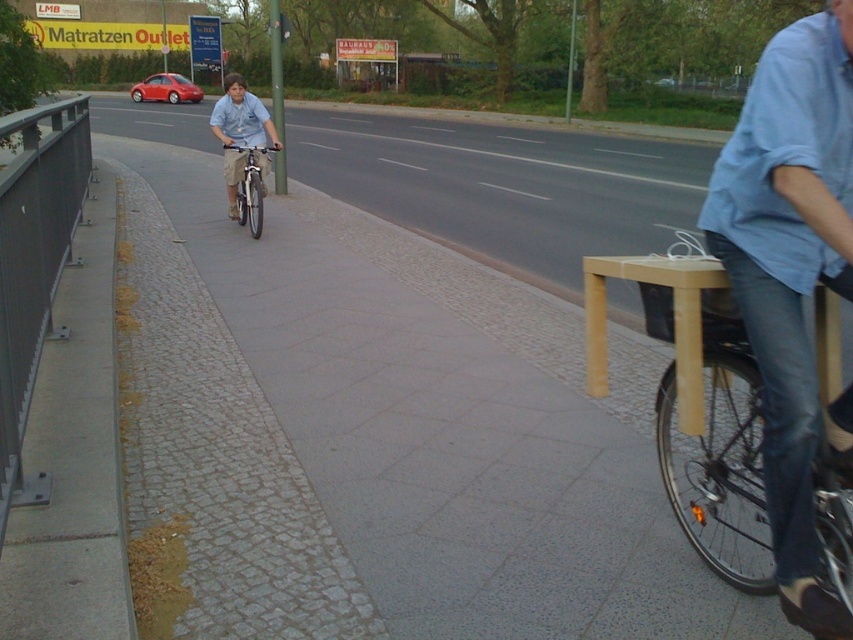
You are a delivery person who needs to place a package on the blue denim jeans at center and the dark gray metal rail at left. Based on the scene, which object is shorter and thus more suitable for placing the package without it falling off?

The blue denim jeans at center is shorter than the dark gray metal rail at left, so placing the package on the blue denim jeans at center would be more suitable to prevent it from falling off.

You are a delivery person carrying a large box that is 1 meter wide. You need to walk along the sidewalk between the blue denim jeans at center and the dark gray metal rail at left. Can you fit through the space between them?

The blue denim jeans at center has a width less than the dark gray metal rail at left, but the exact distance between them isn